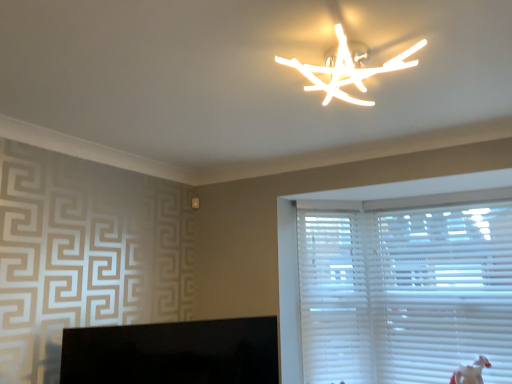
Question: Considering their positions, is black glossy monitor at lower left located in front of or behind white plastic blinds at right?

Choices:
 (A) behind
 (B) front

Answer: (B)

Question: From the image's perspective, is black glossy monitor at lower left located above or below white plastic blinds at right?

Choices:
 (A) above
 (B) below

Answer: (B)

Question: Estimate the real-world distances between objects in this image. Which object is closer to the white plastic blinds at right?

Choices:
 (A) black glossy monitor at lower left
 (B) white matte branch-like fixture at upper center
 (C) white plastic blinds at right

Answer: (C)

Question: Which is farther from the white matte branch-like fixture at upper center?

Choices:
 (A) black glossy monitor at lower left
 (B) white plastic blinds at right
 (C) white plastic blinds at right

Answer: (B)